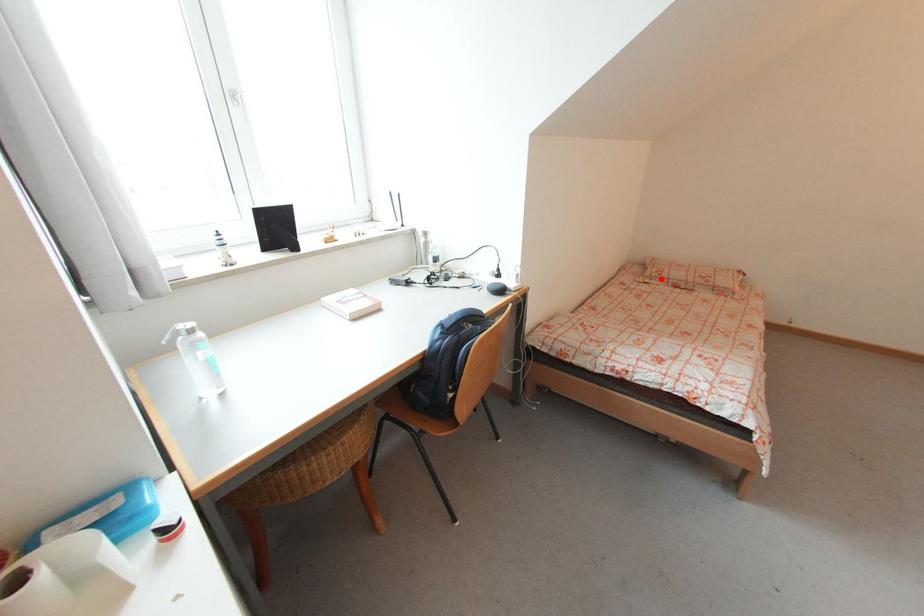
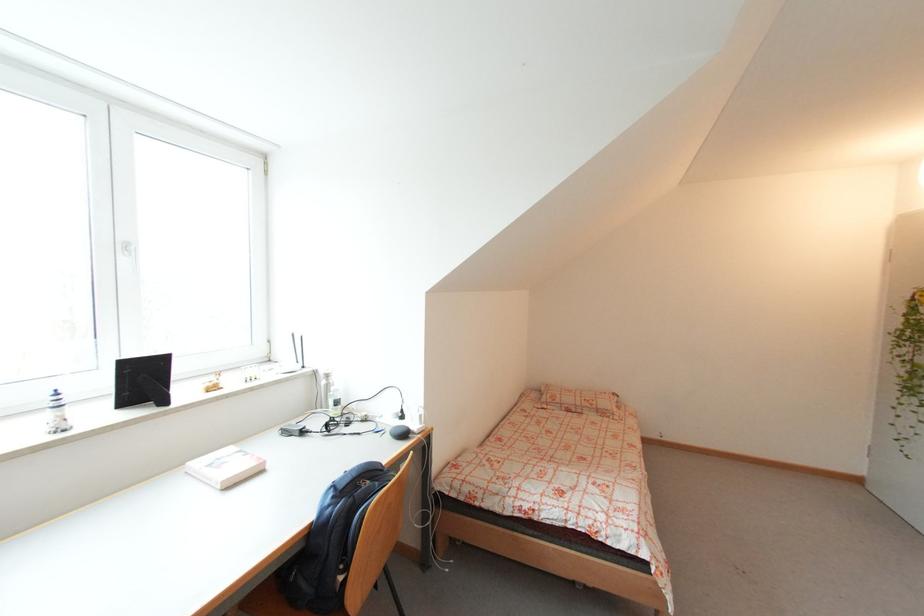
Where in the second image is the point corresponding to the highlighted location from the first image?

(555, 405)